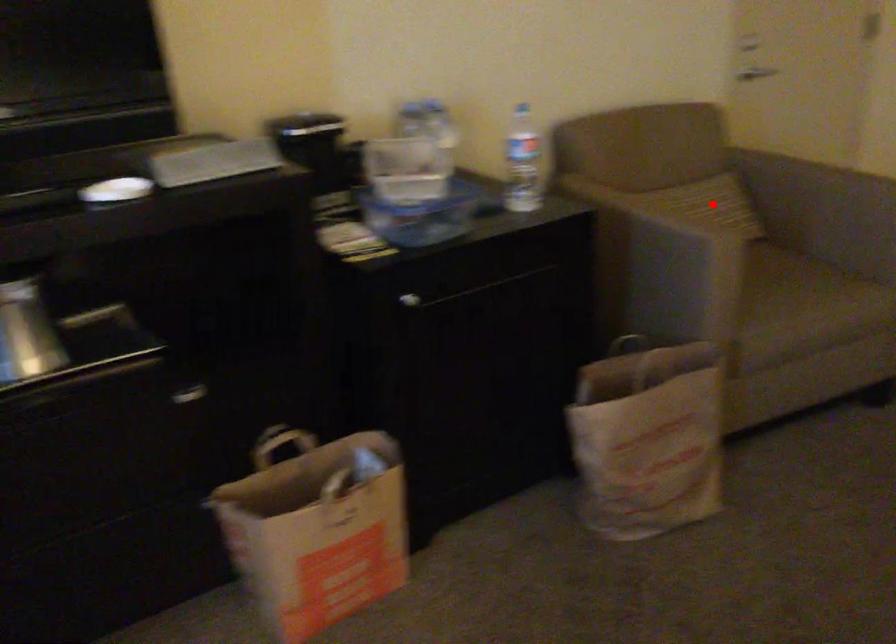
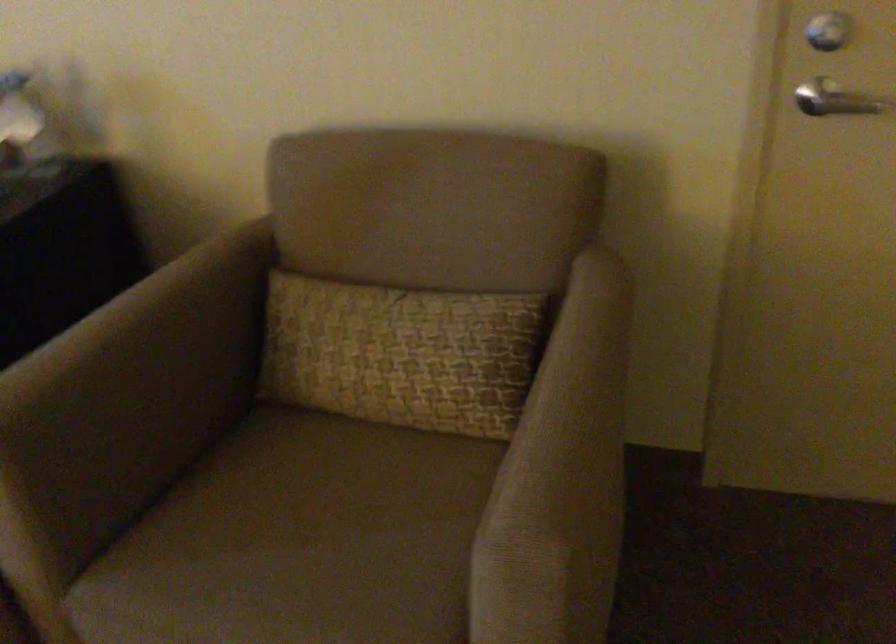
Locate, in the second image, the point that corresponds to the highlighted location in the first image.

(401, 353)